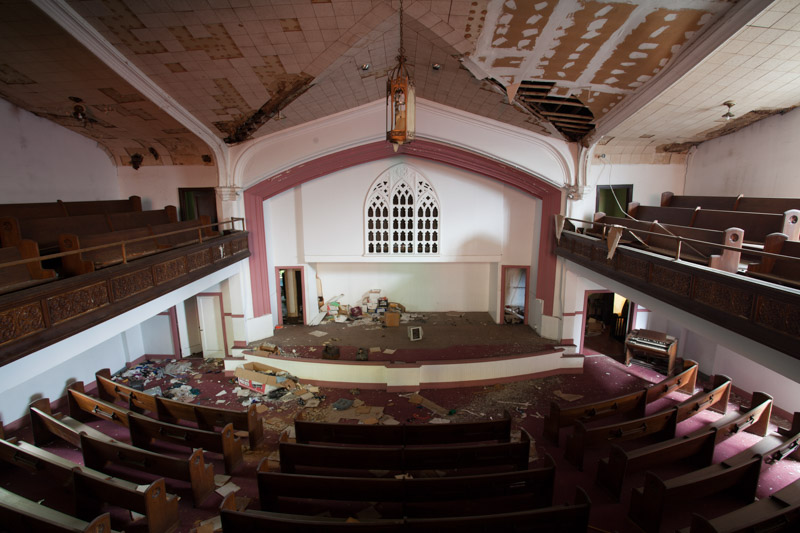
Identify the location of fallen ceiling tiles. (390, 350).